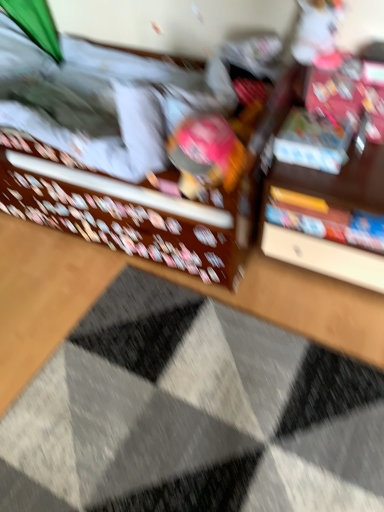
Describe the element at coordinates (313, 141) in the screenshot. I see `matte plastic book at upper right, which is the first book from top to bottom` at that location.

Find the location of `matte brown bed at center`. matte brown bed at center is located at coordinates (130, 153).

In order to click on matte plastic toy at center in this screenshot , I will do `click(206, 154)`.

Which is less distant, (x=170, y=207) or (x=97, y=451)?

Clearly, point (x=170, y=207) is more distant from the camera than point (x=97, y=451).

This screenshot has width=384, height=512. Identify the location of bed on the left of textured gray doormat at center. (130, 153).

Can you confirm if matte brown bed at center is bigger than textured gray doormat at center?

Indeed, matte brown bed at center has a larger size compared to textured gray doormat at center.

Which object is further away from the camera taking this photo, matte brown bed at center or textured gray doormat at center?

textured gray doormat at center is further away from the camera.

Is matte plastic book at upper right, placed as the 2th book when sorted from bottom to top, touching matte plastic toy at center?

No, matte plastic book at upper right, placed as the 2th book when sorted from bottom to top, is not next to matte plastic toy at center.

Who is taller, matte plastic book at upper right, which is the first book from top to bottom, or matte plastic toy at center?

With more height is matte plastic toy at center.

Is the depth of matte plastic book at upper right, which is the first book from top to bottom, less than that of matte plastic toy at center?

No, the depth of matte plastic book at upper right, which is the first book from top to bottom, is greater than that of matte plastic toy at center.

This screenshot has height=512, width=384. I want to click on toy in front of the hardcover book at center, the 1th book positioned from the bottom, so click(x=206, y=154).

From the image's perspective, which is below, matte plastic toy at center or hardcover book at center, the 1th book positioned from the bottom?

hardcover book at center, the 1th book positioned from the bottom.

Is matte plastic toy at center turned away from hardcover book at center, the second book in the top-to-bottom sequence?

No, matte plastic toy at center is not facing away from hardcover book at center, the second book in the top-to-bottom sequence.

Visually, is matte plastic book at upper right, placed as the 2th book when sorted from bottom to top, positioned to the left or to the right of matte brown bed at center?

Clearly, matte plastic book at upper right, placed as the 2th book when sorted from bottom to top, is on the right of matte brown bed at center in the image.

Looking at this image, from the image's perspective, between matte plastic book at upper right, placed as the 2th book when sorted from bottom to top, and matte brown bed at center, which one is located above?

matte brown bed at center appears higher in the image.

From the image's perspective, is matte plastic book at upper right, placed as the 2th book when sorted from bottom to top, above hardcover book at center, the 1th book positioned from the bottom?

Correct, matte plastic book at upper right, placed as the 2th book when sorted from bottom to top, appears higher than hardcover book at center, the 1th book positioned from the bottom, in the image.

Between matte plastic book at upper right, which is the first book from top to bottom, and hardcover book at center, the second book in the top-to-bottom sequence, which one has more height?

With more height is hardcover book at center, the second book in the top-to-bottom sequence.

Is hardcover book at center, the 1th book positioned from the bottom, aimed at matte plastic toy at center?

Result: No, hardcover book at center, the 1th book positioned from the bottom, is not aimed at matte plastic toy at center.

Considering the relative sizes of hardcover book at center, the 1th book positioned from the bottom, and matte plastic toy at center in the image provided, is hardcover book at center, the 1th book positioned from the bottom, bigger than matte plastic toy at center?

No, hardcover book at center, the 1th book positioned from the bottom, is not bigger than matte plastic toy at center.

Is hardcover book at center, the 1th book positioned from the bottom, not inside matte plastic toy at center?

Absolutely, hardcover book at center, the 1th book positioned from the bottom, is external to matte plastic toy at center.

What's the angular difference between hardcover book at center, the second book in the top-to-bottom sequence, and matte plastic toy at center's facing directions?

The facing directions of hardcover book at center, the second book in the top-to-bottom sequence, and matte plastic toy at center are 0.385 degrees apart.

Is matte plastic toy at center far from textured gray doormat at center?

matte plastic toy at center is near textured gray doormat at center, not far away.

Is matte plastic toy at center looking in the opposite direction of textured gray doormat at center?

No, matte plastic toy at center is not facing the opposite direction of textured gray doormat at center.

Considering the sizes of objects matte plastic toy at center and textured gray doormat at center in the image provided, who is smaller, matte plastic toy at center or textured gray doormat at center?

With smaller size is matte plastic toy at center.

Locate an element on the screen. The image size is (384, 512). bed that appears above the textured gray doormat at center (from a real-world perspective) is located at coordinates (130, 153).

The height and width of the screenshot is (512, 384). What are the coordinates of `the 1st book directly beneath the matte plastic toy at center (from a real-world perspective)` in the screenshot? It's located at (313, 141).

Based on their spatial positions, is matte brown bed at center or textured gray doormat at center closer to hardcover book at center, the 1th book positioned from the bottom?

matte brown bed at center is positioned closer to the anchor hardcover book at center, the 1th book positioned from the bottom.

Looking at the image, which one is located closer to matte brown bed at center, matte plastic book at upper right, placed as the 2th book when sorted from bottom to top, or textured gray doormat at center?

Among the two, matte plastic book at upper right, placed as the 2th book when sorted from bottom to top, is located nearer to matte brown bed at center.

Looking at the image, which one is located closer to matte plastic toy at center, matte brown bed at center or hardcover book at center, the 1th book positioned from the bottom?

matte brown bed at center.

From the image, which object appears to be nearer to matte brown bed at center, textured gray doormat at center or hardcover book at center, the second book in the top-to-bottom sequence?

hardcover book at center, the second book in the top-to-bottom sequence, is positioned closer to the anchor matte brown bed at center.

Estimate the real-world distances between objects in this image. Which object is further from hardcover book at center, the 1th book positioned from the bottom, textured gray doormat at center or matte plastic toy at center?

Based on the image, textured gray doormat at center appears to be further to hardcover book at center, the 1th book positioned from the bottom.

Based on their spatial positions, is textured gray doormat at center or matte brown bed at center further from matte plastic book at upper right, placed as the 2th book when sorted from bottom to top?

textured gray doormat at center.

Estimate the real-world distances between objects in this image. Which object is further from matte brown bed at center, matte plastic book at upper right, which is the first book from top to bottom, or hardcover book at center, the 1th book positioned from the bottom?

Among the two, hardcover book at center, the 1th book positioned from the bottom, is located further to matte brown bed at center.

Based on their spatial positions, is hardcover book at center, the second book in the top-to-bottom sequence, or matte plastic toy at center closer to matte plastic book at upper right, placed as the 2th book when sorted from bottom to top?

hardcover book at center, the second book in the top-to-bottom sequence, is positioned closer to the anchor matte plastic book at upper right, placed as the 2th book when sorted from bottom to top.

Locate an element on the screen. The image size is (384, 512). toy located between matte brown bed at center and hardcover book at center, the 1th book positioned from the bottom, in the left-right direction is located at coordinates (206, 154).

Identify the location of book between matte plastic toy at center and textured gray doormat at center in the vertical direction. This screenshot has width=384, height=512. (324, 219).

At what (x,y) coordinates should I click in order to perform the action: click on book between matte plastic book at upper right, which is the first book from top to bottom, and textured gray doormat at center in the up-down direction. Please return your answer as a coordinate pair (x, y). Looking at the image, I should click on (324, 219).

I want to click on book between matte brown bed at center and hardcover book at center, the second book in the top-to-bottom sequence, in the horizontal direction, so click(313, 141).